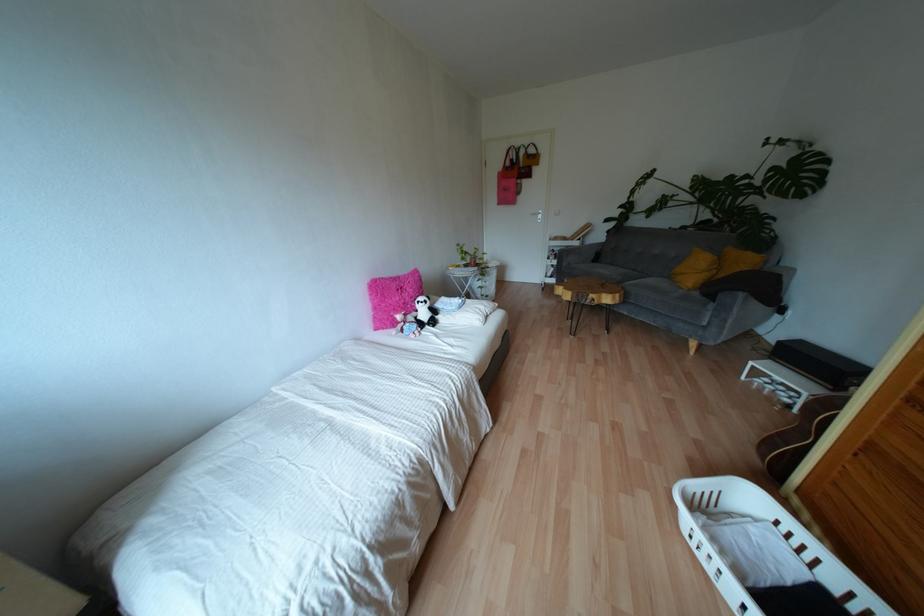
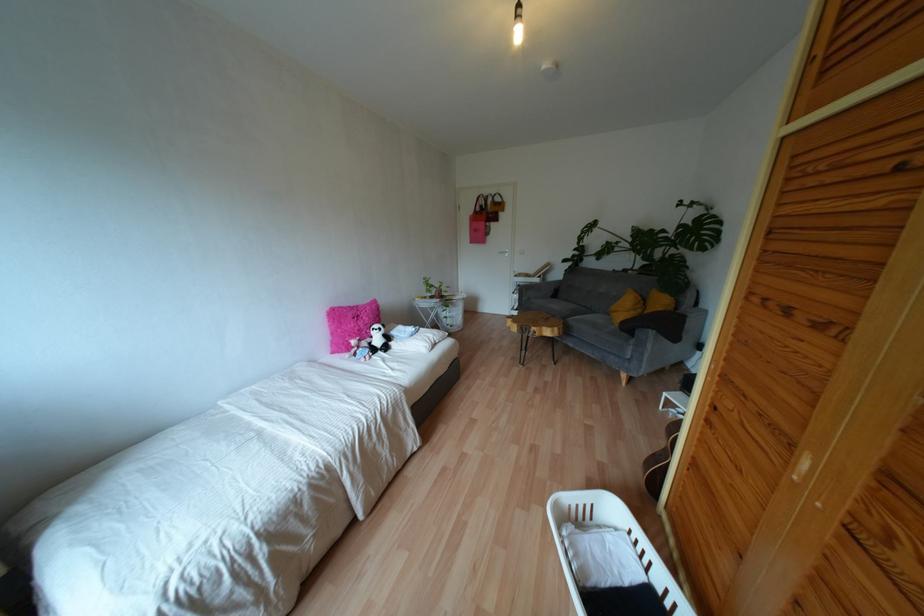
In the second image, find the point that corresponds to (506,163) in the first image.

(477, 208)